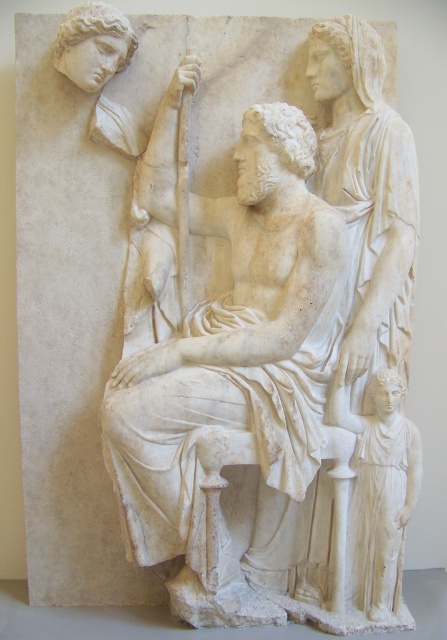
Question: Considering the relative positions of white marble statue at center and white marble statue at lower right in the image provided, where is white marble statue at center located with respect to white marble statue at lower right?

Choices:
 (A) right
 (B) left

Answer: (B)

Question: Is white marble statue at center positioned in front of white marble statue at lower right?

Choices:
 (A) no
 (B) yes

Answer: (B)

Question: Which of the following is the closest to the observer?

Choices:
 (A) white marble statue at lower right
 (B) white marble statue at center

Answer: (B)

Question: Is white marble statue at center to the right of white marble statue at lower right from the viewer's perspective?

Choices:
 (A) yes
 (B) no

Answer: (B)